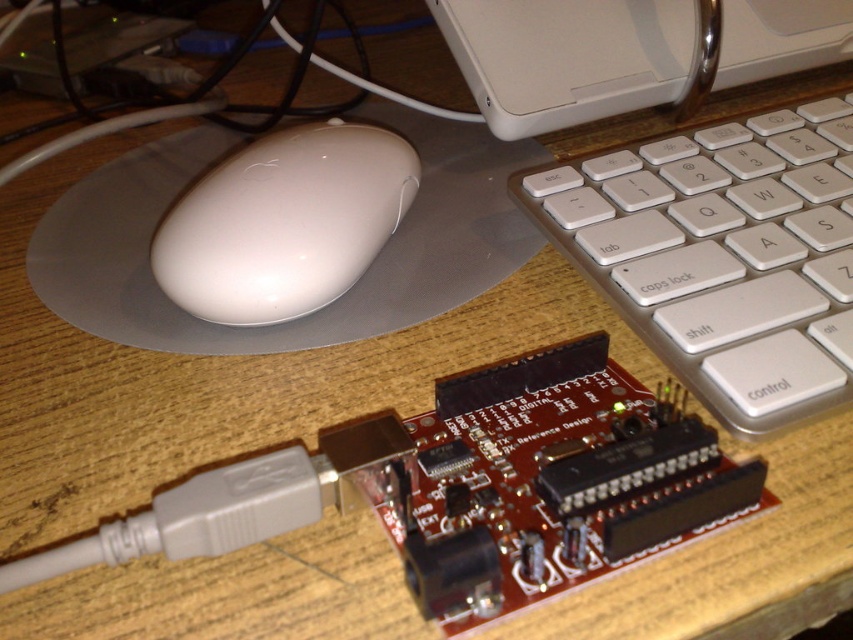
You are a robot arm trying to pick up the circuit board. The circuit board is at point (590,275). Your gripper can reach 40 centimeters. Can you reach it?

The distance between the robot arm and the circuit board at point (590,275) is 40.41 centimeters, so the gripper cannot reach it since it is slightly beyond the 40 centimeter limit.

You are setting up a new workspace and want to place a small plant between the white glossy mouse at center and the white plastic computer at upper center. Which object is closer to the front of the workspace so the plant can be placed in front of it?

Answer: The white glossy mouse at center is closer to the front of the workspace than the white plastic computer at upper center because it is not as tall, so placing the plant in front of the mouse would position it at the front.

You are setting up a new desk and need to place both the white plastic keyboard at center and the white plastic computer at upper center. Based on their thickness, which one should you place first if you want to ensure the thicker item is at the back for better visibility?

The white plastic computer at upper center is thicker than the white plastic keyboard at center. Therefore, you should place the white plastic computer at upper center first at the back to ensure it is visible.